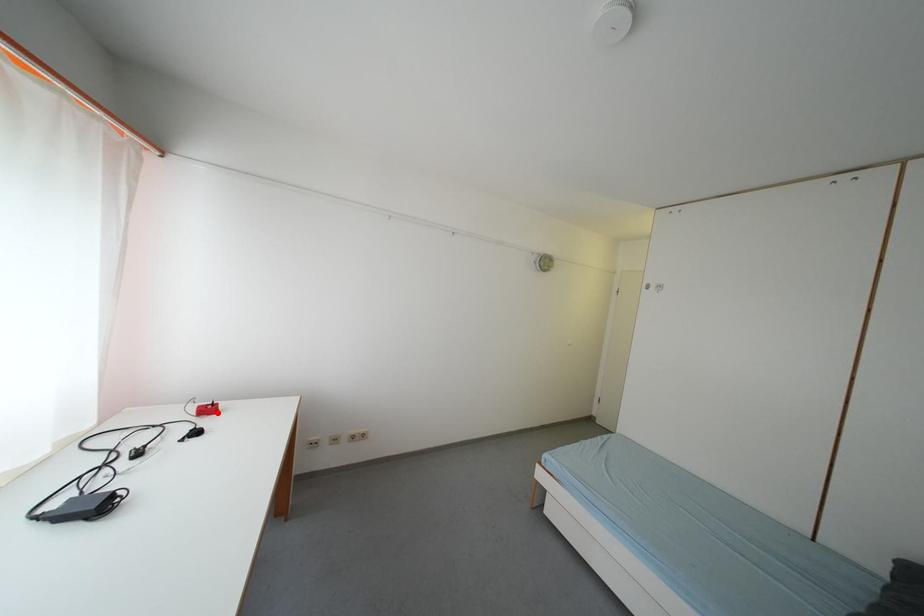
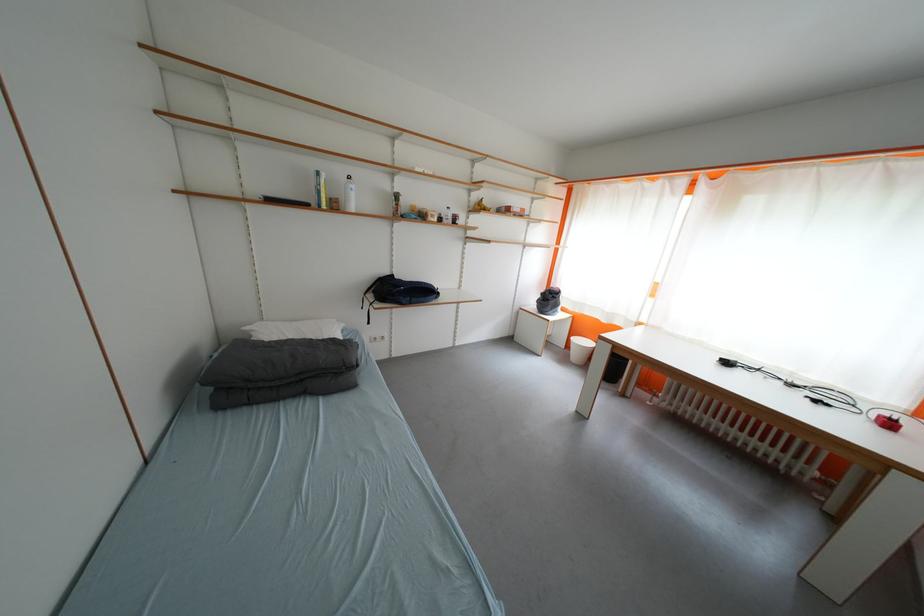
Where in the second image is the point corresponding to the highlighted location from the first image?

(897, 428)